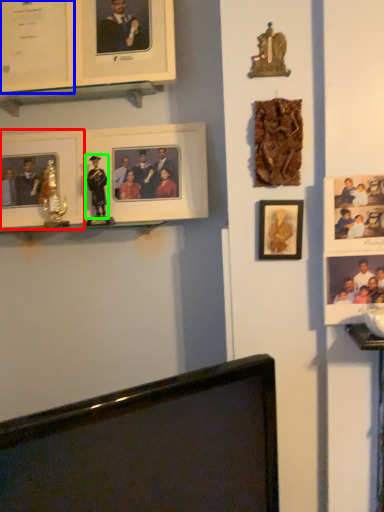
Question: Considering the real-world distances, which object is closest to picture frame (highlighted by a red box)? picture frame (highlighted by a blue box) or person (highlighted by a green box).

Choices:
 (A) picture frame
 (B) person

Answer: (B)